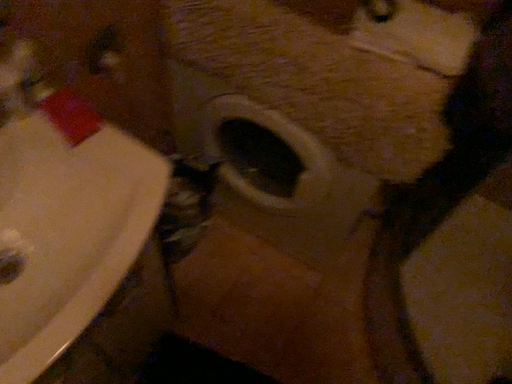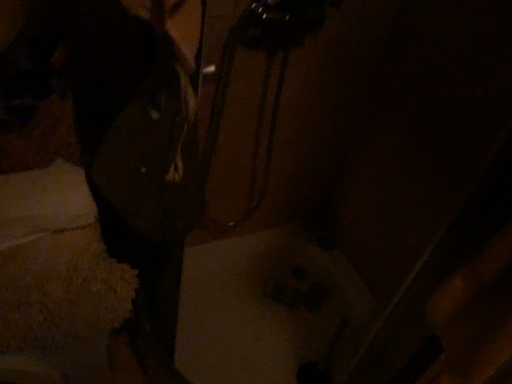
Question: Which way did the camera rotate in the video?

Choices:
 (A) rotated left
 (B) rotated right

Answer: (B)